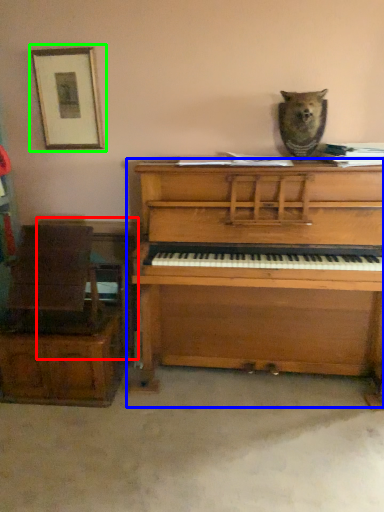
Question: Estimate the real-world distances between objects in this image. Which object is farther from table (highlighted by a red box), piano (highlighted by a blue box) or picture frame (highlighted by a green box)?

Choices:
 (A) piano
 (B) picture frame

Answer: (B)